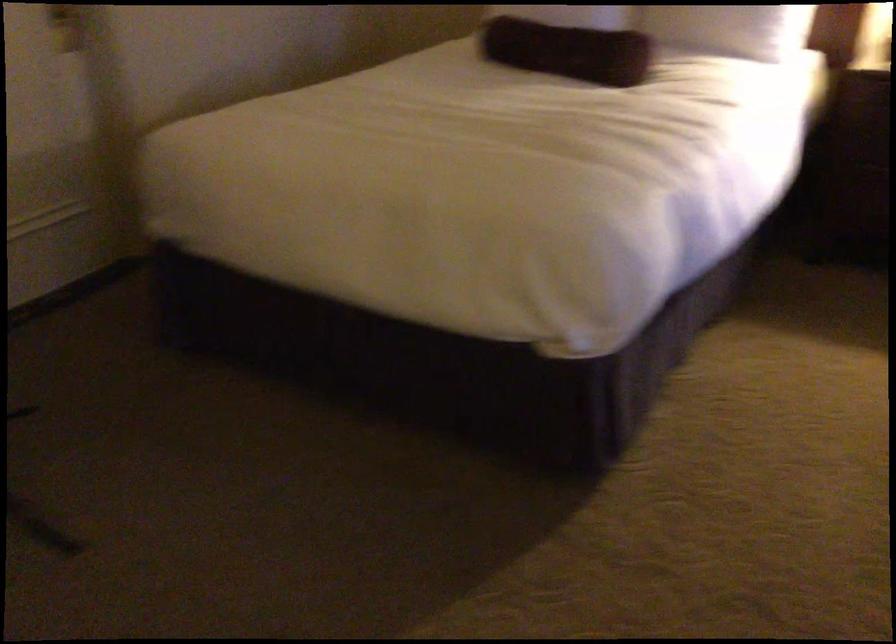
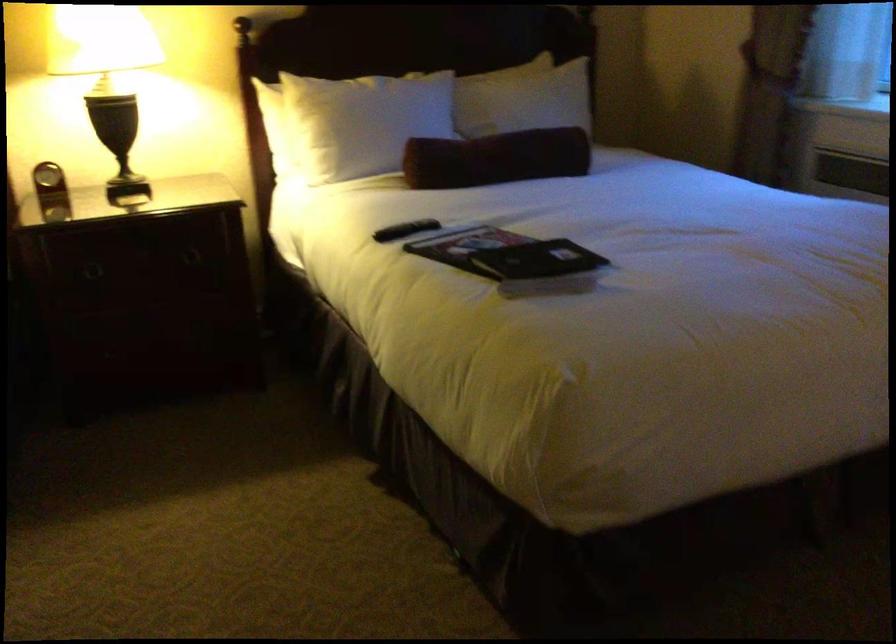
Question: The first image is from the beginning of the video and the second image is from the end. How did the camera likely rotate when shooting the video?

Choices:
 (A) Left
 (B) Right
 (C) Up
 (D) Down

Answer: (B)